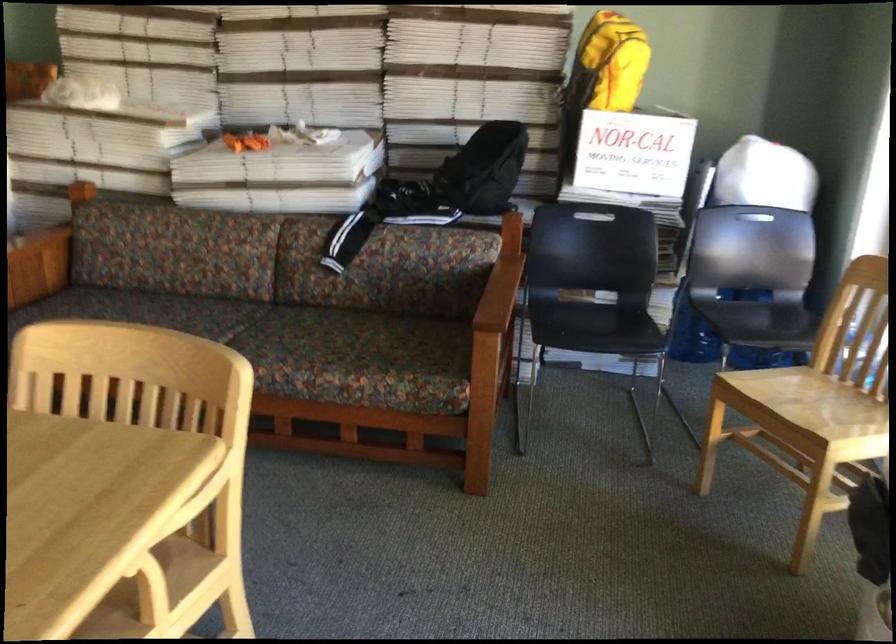
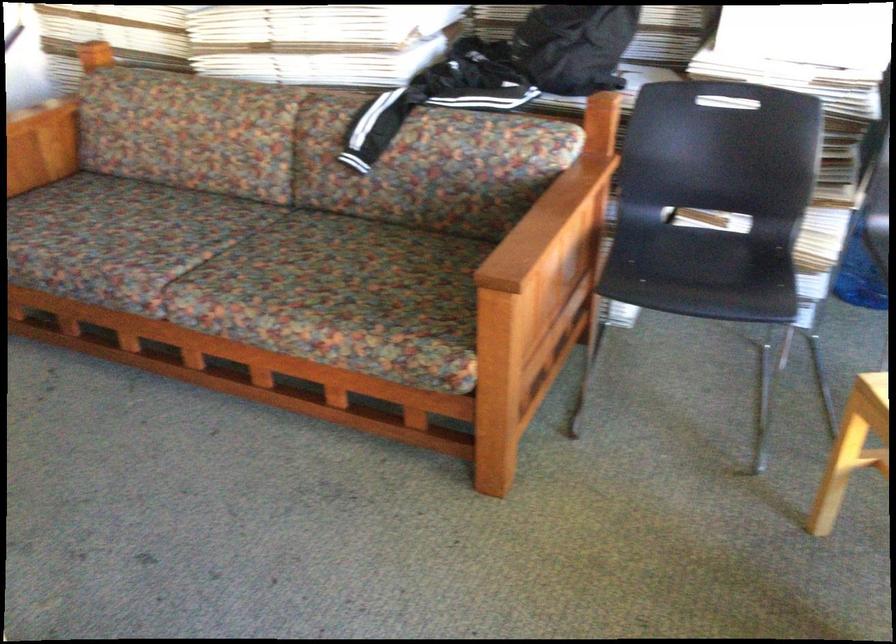
Locate, in the second image, the point that corresponds to point (504, 288) in the first image.

(545, 222)